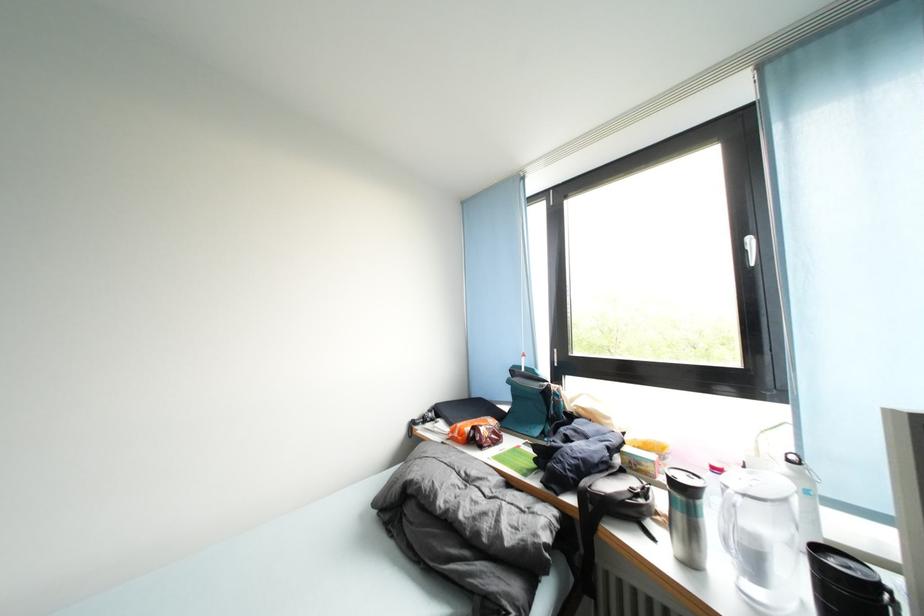
What are the coordinates of `water pitcher handle` in the screenshot? It's located at (761, 537).